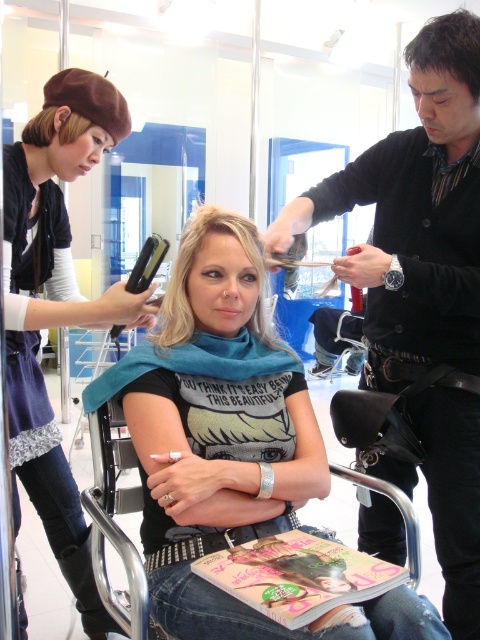
Question: In this image, where is matte paper magazine at center located relative to matte brown hair at upper left?

Choices:
 (A) left
 (B) right

Answer: (B)

Question: Where is matte paper magazine at center located in relation to blonde hair at center in the image?

Choices:
 (A) below
 (B) above

Answer: (A)

Question: Does matte black shirt at center appear under matte brown hair at upper left?

Choices:
 (A) yes
 (B) no

Answer: (A)

Question: Among these objects, which one is farthest from the camera?

Choices:
 (A) matte black shirt at center
 (B) brown beret at upper left
 (C) blonde hair at center

Answer: (C)

Question: Which object appears farthest from the camera in this image?

Choices:
 (A) dark brown hair at upper right
 (B) matte paper magazine at center

Answer: (A)

Question: Which object is the farthest from the blonde hair at center?

Choices:
 (A) matte paper magazine at center
 (B) dark brown hair at upper right
 (C) black leather belt at upper right

Answer: (B)